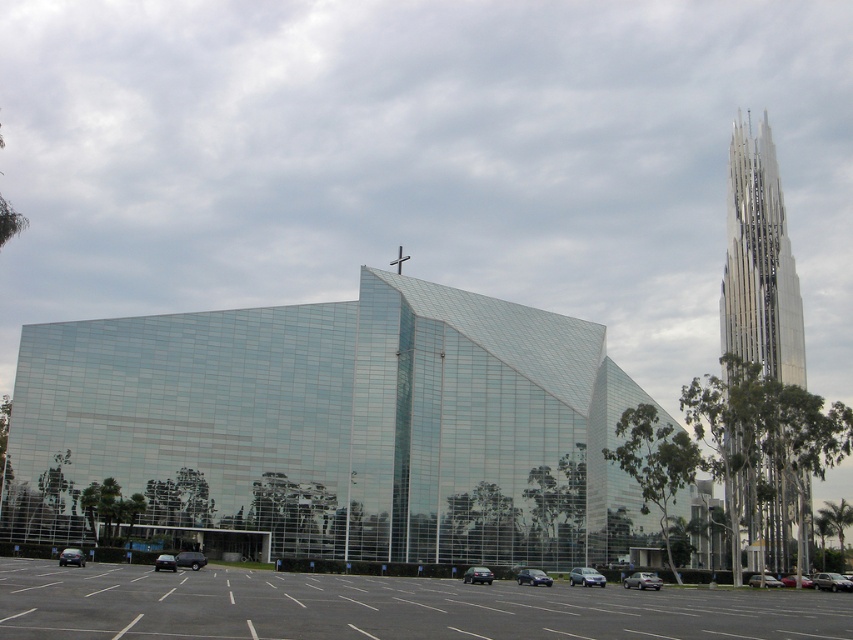
Based on the photo, you are a delivery driver approaching the church and need to park your silver metallic sedan at lower center. The parking lot has a designated parking spot at coordinates point 0.908, 0.754. Is your current position already aligned with the parking spot?

The silver metallic sedan at lower center is positioned exactly at point [642,580], so yes, it is already aligned with the parking spot.

You are a visitor arriving at the church and notice two cars parked nearby. You see the matte black car at center and the shiny black car at lower left. Which car is positioned closer to the ground?

The matte black car at center is below the shiny black car at lower left, so it is positioned closer to the ground.

You are standing in front of the modern church and notice two points marked on the building. The first point is at coordinates point (733, 176) and the second is at point (184, 552). Which point is closer to you?

Point (733, 176) is further to the camera than point (184, 552), so the point closer to you is point (184, 552).